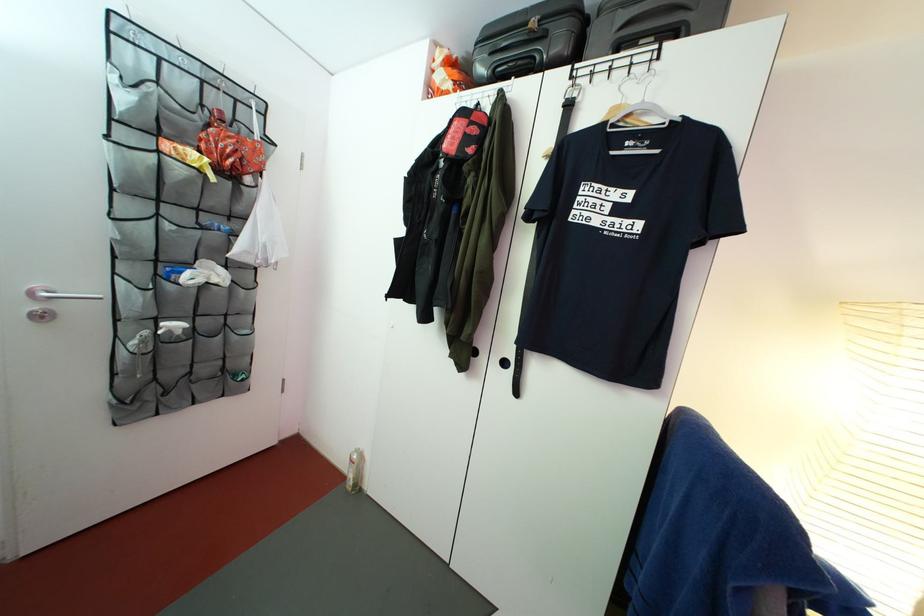
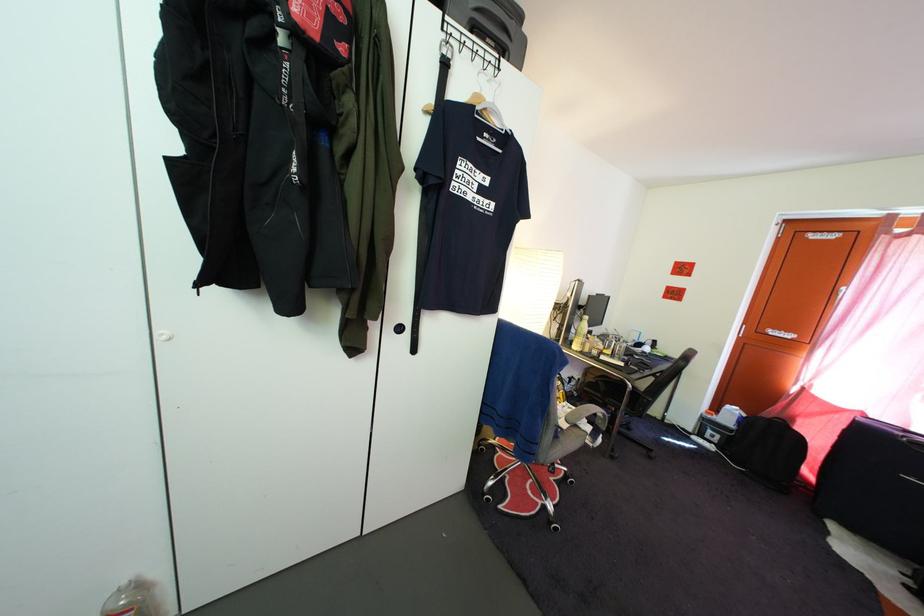
In the second image, find the point that corresponds to point 367,456 in the first image.

(132, 591)